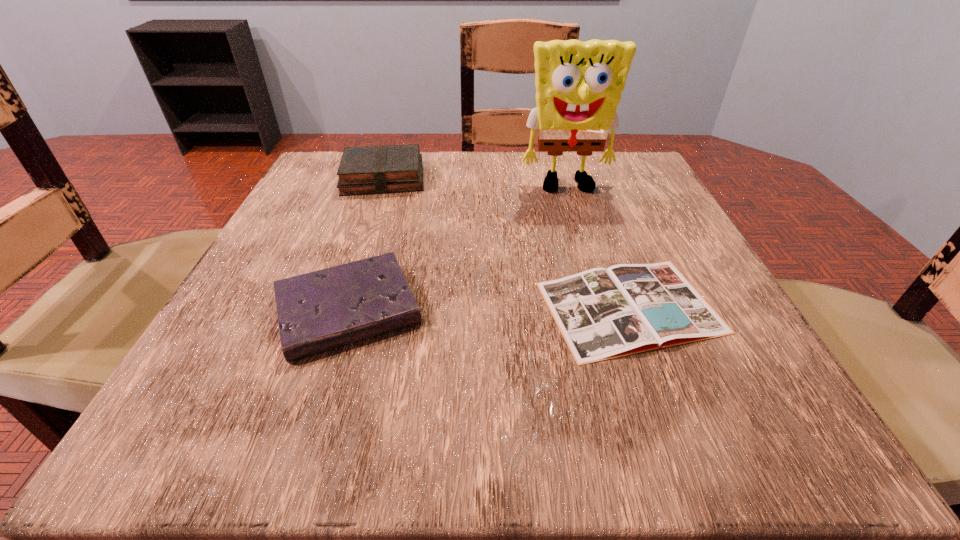
I want to click on vacant space at the left edge of the desktop, so click(242, 287).

Find the location of `vacant space at the right edge of the desktop`. vacant space at the right edge of the desktop is located at coordinates [x=661, y=224].

Locate an element on the screen. Image resolution: width=960 pixels, height=540 pixels. free space at the near left corner of the desktop is located at coordinates (267, 420).

Locate an element on the screen. This screenshot has height=540, width=960. free space at the far right corner of the desktop is located at coordinates (574, 167).

In the image, there is a desktop. In order to click on vacant space at the near right corner in this screenshot , I will do `click(820, 448)`.

Where is `free space that is in between the left book and the second shortest object`? This screenshot has height=540, width=960. free space that is in between the left book and the second shortest object is located at coordinates (366, 244).

This screenshot has height=540, width=960. Find the location of `free space between the diary and the taller book`. free space between the diary and the taller book is located at coordinates (366, 244).

Find the location of a particular element. The height and width of the screenshot is (540, 960). vacant space that is in between the diary and the tallest object is located at coordinates (458, 249).

Where is `free spot between the taller book and the diary`? This screenshot has width=960, height=540. free spot between the taller book and the diary is located at coordinates (366, 244).

Find the location of `vacant space that's between the diary and the taller book`. vacant space that's between the diary and the taller book is located at coordinates (366, 244).